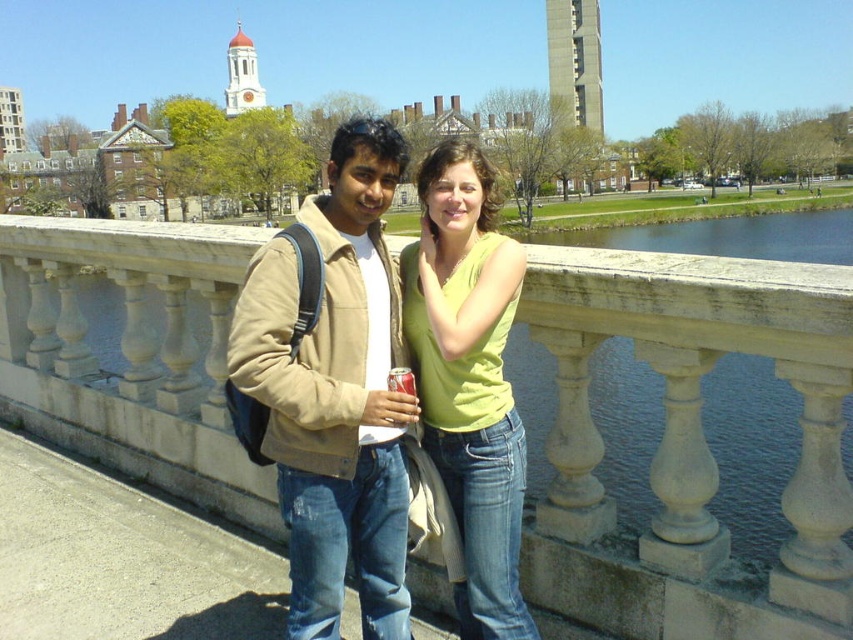
Does white stone bridge at center lie behind matte red can at center?

No, it is not.

In the scene shown: Measure the distance between white stone bridge at center and camera.

The distance of white stone bridge at center from camera is 7.00 meters.

What do you see at coordinates (688, 444) in the screenshot? I see `white stone bridge at center` at bounding box center [688, 444].

Locate an element on the screen. The height and width of the screenshot is (640, 853). white stone bridge at center is located at coordinates (688, 444).

Is point (287, 369) farther from viewer compared to point (399, 372)?

No, (287, 369) is in front of (399, 372).

Who is positioned more to the left, matte beige jacket at center or matte red can at center?

Positioned to the left is matte beige jacket at center.

This screenshot has height=640, width=853. What do you see at coordinates (335, 394) in the screenshot? I see `matte beige jacket at center` at bounding box center [335, 394].

Identify the location of matte beige jacket at center. (335, 394).

Between matte beige jacket at center and lime green jersey at center, which one appears on the right side from the viewer's perspective?

From the viewer's perspective, lime green jersey at center appears more on the right side.

Which is behind, point (343, 262) or point (450, 186)?

The point (450, 186) is more distant.

Which is in front, point (258, 333) or point (422, 278)?

Point (258, 333) is more forward.

At what (x,y) coordinates should I click in order to perform the action: click on matte beige jacket at center. Please return your answer as a coordinate pair (x, y). Looking at the image, I should click on point(335,394).